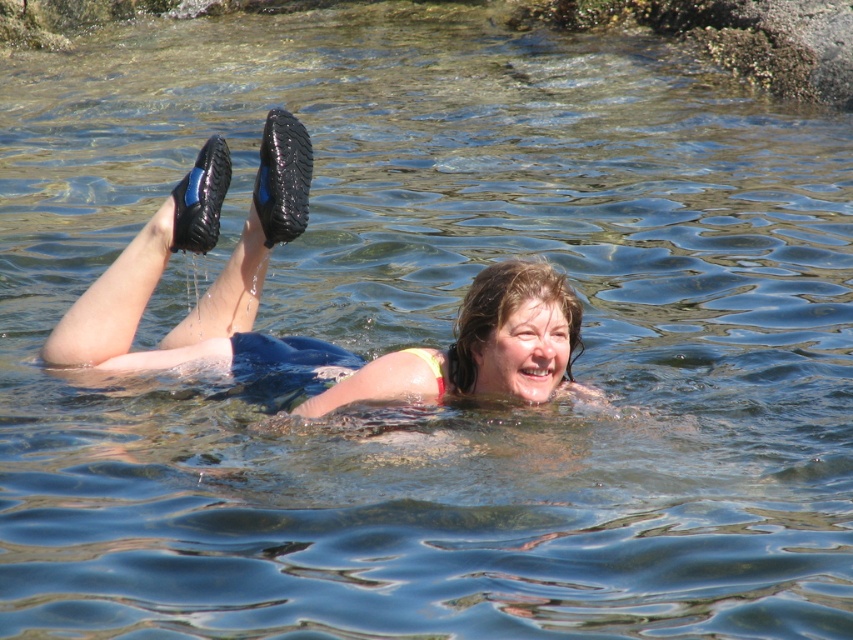
Question: Among these points, which one is nearest to the camera?

Choices:
 (A) (494, 364)
 (B) (212, 243)
 (C) (280, 234)

Answer: (A)

Question: Which point is farther to the camera?

Choices:
 (A) matte black shoes at center
 (B) black rubber boot at upper left
 (C) rubber/soft-soled shoe at upper center

Answer: (C)

Question: Which object appears closest to the camera in this image?

Choices:
 (A) rubber/soft-soled shoe at upper center
 (B) black rubber boot at upper left
 (C) matte black shoes at center

Answer: (C)

Question: Is matte black shoes at center thinner than rubber/soft-soled shoe at upper center?

Choices:
 (A) no
 (B) yes

Answer: (A)

Question: Can you confirm if matte black shoes at center is positioned above rubber/soft-soled shoe at upper center?

Choices:
 (A) yes
 (B) no

Answer: (B)

Question: Can you confirm if matte black shoes at center is positioned above rubber/soft-soled shoe at upper center?

Choices:
 (A) yes
 (B) no

Answer: (B)